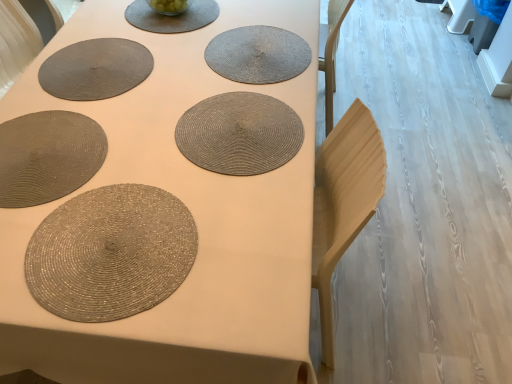
Identify the location of free space above rattan placemat at lower left, acting as the 2th paper plate starting from the back (from a real-world perspective). (41, 148).